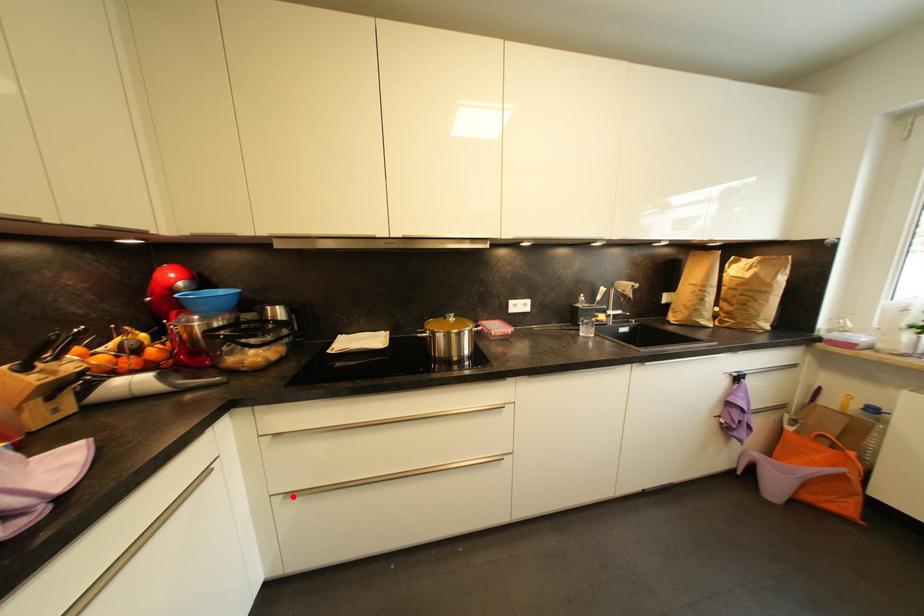
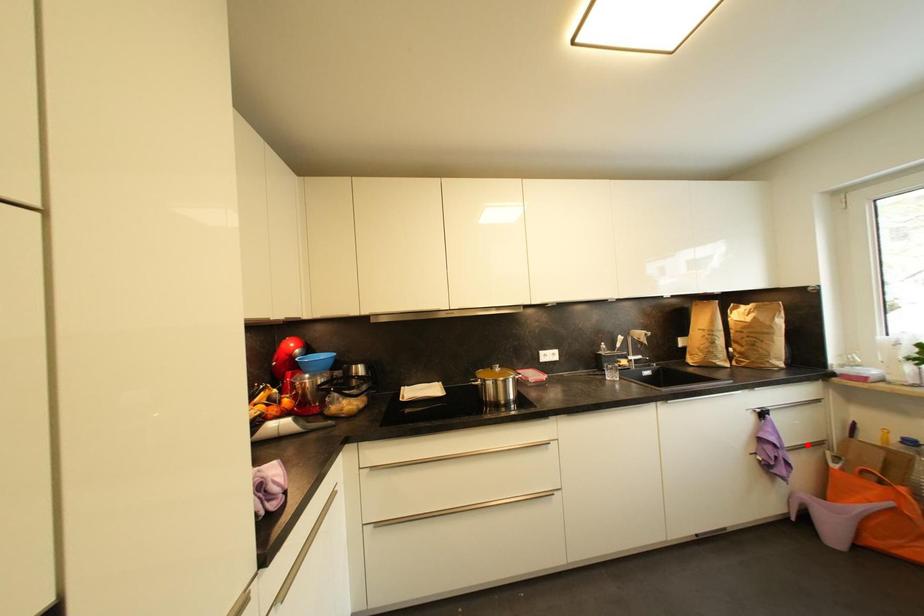
I am providing you with two images of the same scene from different viewpoints. A red point is marked on the first image and another point is marked on the second image. Is the marked point in image1 the same physical position as the marked point in image2?

No